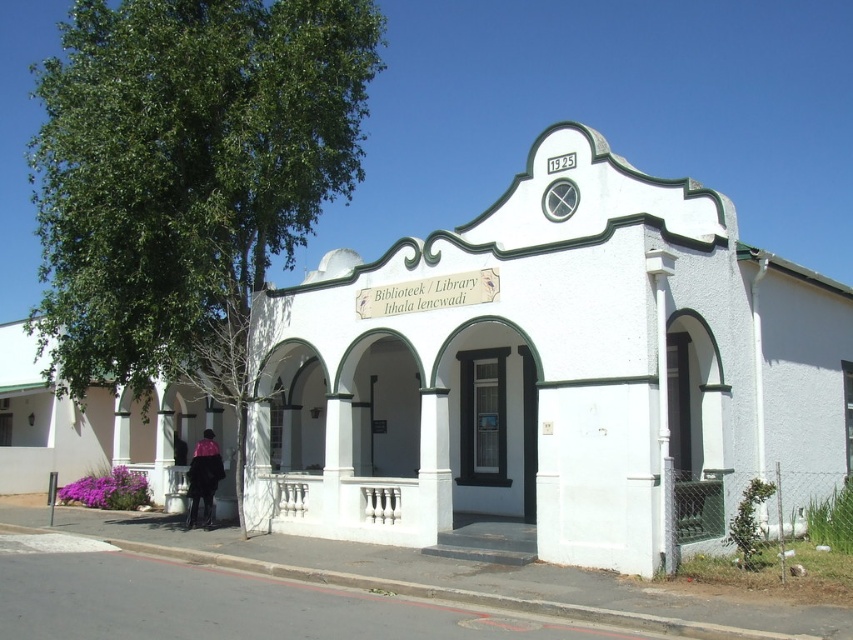
Question: Which object is farther from the camera taking this photo?

Choices:
 (A) white painted wall at center
 (B) velvet purple coat at lower left

Answer: (B)

Question: Is white painted wall at center below velvet purple coat at lower left?

Choices:
 (A) no
 (B) yes

Answer: (A)

Question: In this image, where is white painted wall at center located relative to velvet purple coat at lower left?

Choices:
 (A) below
 (B) above

Answer: (B)

Question: Which point is farther to the camera?

Choices:
 (A) velvet purple coat at lower left
 (B) white painted wall at center

Answer: (A)

Question: Can you confirm if white painted wall at center is positioned above velvet purple coat at lower left?

Choices:
 (A) no
 (B) yes

Answer: (B)

Question: Which point is farther to the camera?

Choices:
 (A) (207, 465)
 (B) (283, 497)

Answer: (A)